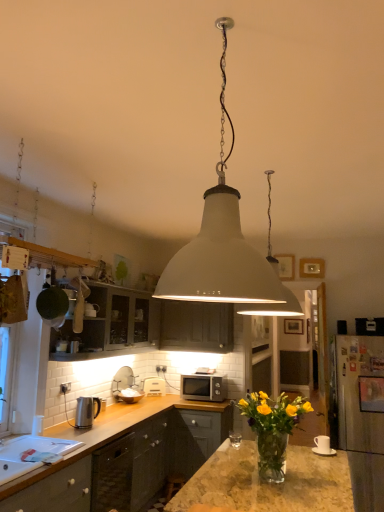
Question: Is white matte microwave at center, the second appliance from the left, thinner than translucent glass vase at center?

Choices:
 (A) yes
 (B) no

Answer: (A)

Question: Can you confirm if white matte microwave at center, which is counted as the second appliance, starting from the front, is positioned to the left of translucent glass vase at center?

Choices:
 (A) yes
 (B) no

Answer: (A)

Question: From a real-world perspective, is white matte microwave at center, which is counted as the 1th appliance, starting from the back, on translucent glass vase at center?

Choices:
 (A) yes
 (B) no

Answer: (B)

Question: Is white matte microwave at center, the second appliance from the left, not inside translucent glass vase at center?

Choices:
 (A) yes
 (B) no

Answer: (A)

Question: Could you tell me if white matte microwave at center, which is the 1th appliance from bottom to top, is facing translucent glass vase at center?

Choices:
 (A) no
 (B) yes

Answer: (B)

Question: Can you confirm if white matte microwave at center, which is counted as the second appliance, starting from the front, is positioned to the right of translucent glass vase at center?

Choices:
 (A) no
 (B) yes

Answer: (A)

Question: Is white plastic electric outlet at center turned away from white matte pendant light at center, marked as the 2th lamp in a left-to-right arrangement?

Choices:
 (A) yes
 (B) no

Answer: (B)

Question: Can we say white plastic electric outlet at center lies outside white matte pendant light at center, the first lamp positioned from the right?

Choices:
 (A) no
 (B) yes

Answer: (B)

Question: Considering the relative positions of white plastic electric outlet at center and white matte pendant light at center, marked as the 2th lamp in a left-to-right arrangement, in the image provided, is white plastic electric outlet at center to the left of white matte pendant light at center, marked as the 2th lamp in a left-to-right arrangement, from the viewer's perspective?

Choices:
 (A) no
 (B) yes

Answer: (B)

Question: Is white matte pendant light at center, the first lamp in the back-to-front sequence, located within white plastic electric outlet at center?

Choices:
 (A) yes
 (B) no

Answer: (B)

Question: Are white plastic electric outlet at center and white matte pendant light at center, which is the 2th lamp in front-to-back order, beside each other?

Choices:
 (A) no
 (B) yes

Answer: (A)

Question: Considering the relative positions of white plastic electric outlet at center and white matte pendant light at center, the first lamp in the back-to-front sequence, in the image provided, is white plastic electric outlet at center to the right of white matte pendant light at center, the first lamp in the back-to-front sequence, from the viewer's perspective?

Choices:
 (A) yes
 (B) no

Answer: (B)

Question: Considering the relative sizes of matte dark wood cabinets at upper left, which is counted as the second cabinetry, starting from the right, and white plastic electric outlet at center in the image provided, is matte dark wood cabinets at upper left, which is counted as the second cabinetry, starting from the right, shorter than white plastic electric outlet at center?

Choices:
 (A) no
 (B) yes

Answer: (A)